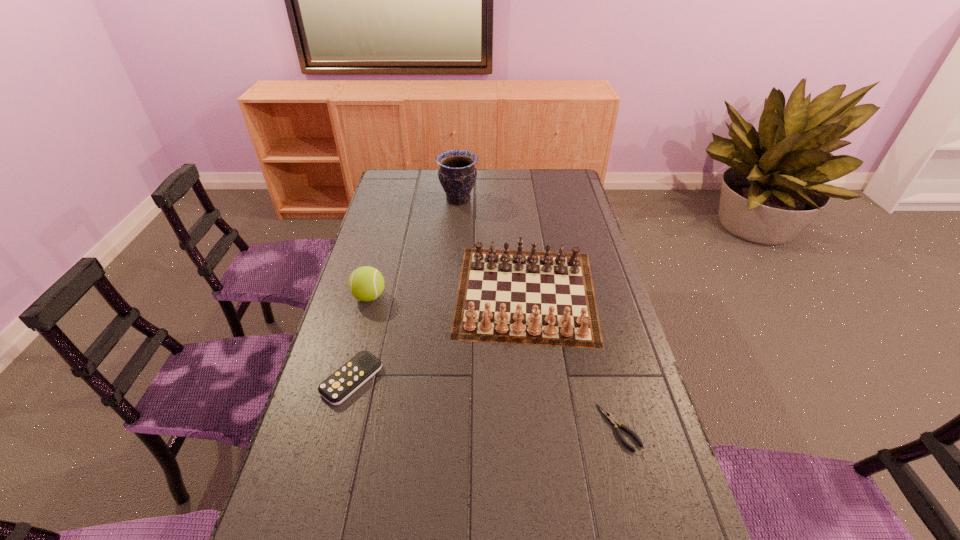
Where is `object that is the third closest to the chessboard`? This screenshot has height=540, width=960. object that is the third closest to the chessboard is located at coordinates (366, 283).

The width and height of the screenshot is (960, 540). I want to click on object that stands as the fourth closest to the chessboard, so [x=457, y=174].

In order to click on free space that satisfies the following two spatial constraints: 1. on the front side of the pliers; 2. on the left side of the tennis ball in this screenshot , I will do `click(333, 428)`.

Image resolution: width=960 pixels, height=540 pixels. I want to click on free space that satisfies the following two spatial constraints: 1. on the back side of the chessboard; 2. on the left side of the remote control, so click(x=374, y=292).

Locate an element on the screen. The height and width of the screenshot is (540, 960). free space that satisfies the following two spatial constraints: 1. on the front side of the tennis ball; 2. on the right side of the shortest object is located at coordinates (333, 428).